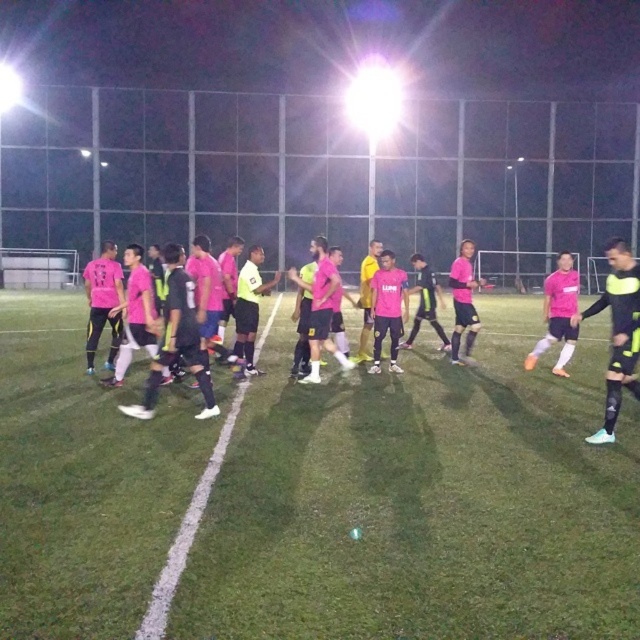
You are a soccer coach observing the nighttime match. You notice the green grass football field at center and the pink matte jersey at left. Which object is shorter in height?

The green grass football field at center is shorter in height than the pink matte jersey at left.

You are a soccer player standing on the green grass football field at center. You want to pass the ball to your teammate wearing the pink matte jersey at left. Which direction should you move to ensure the ball reaches them?

The green grass football field at center is positioned on the left side of the pink matte jersey at left, so you should move to your right to pass the ball towards the pink matte jersey at left.

You are standing in a soccer field and want to kick a ball to the center of the green grass football field at center. If you are currently 10 feet away from the edge of the field, can you reach the center with a kick that travels 15 feet?

The green grass football field at center is 10.45 feet away from you. Since you are 10 feet away from the edge, the total distance to the center is 10.45 feet. Your kick travels 15 feet, which is more than enough to reach the center.